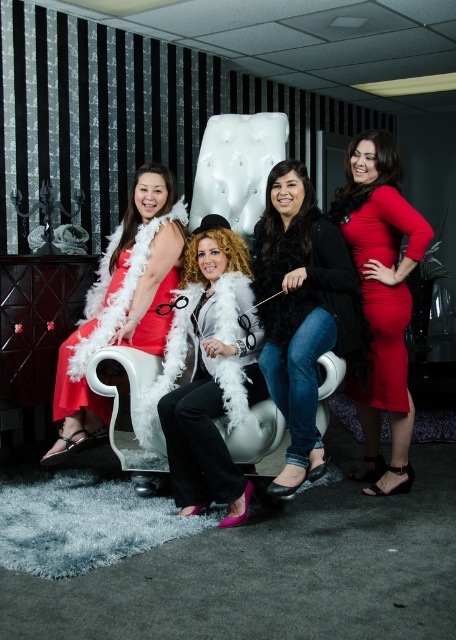
Question: Is matte red dress at right below white fluffy coat at center?

Choices:
 (A) yes
 (B) no

Answer: (B)

Question: Can you confirm if black fur coat at center is thinner than white fluffy coat at center?

Choices:
 (A) yes
 (B) no

Answer: (B)

Question: Does matte red dress at right appear on the right side of white fluffy coat at center?

Choices:
 (A) no
 (B) yes

Answer: (B)

Question: Which of these objects is positioned closest to the matte white feather boa at center?

Choices:
 (A) black fur coat at center
 (B) matte red dress at right

Answer: (A)

Question: Among these points, which one is farthest from the camera?

Choices:
 (A) (357, 221)
 (B) (304, 285)
 (C) (108, 285)
 (D) (207, 420)

Answer: (C)

Question: Considering the real-world distances, which object is farthest from the white fluffy coat at center?

Choices:
 (A) black fur coat at center
 (B) matte red dress at right

Answer: (B)